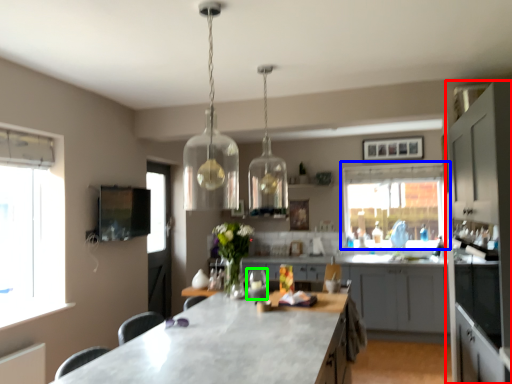
Question: Based on their relative distances, which object is farther from cabinetry (highlighted by a red box)? Choose from window (highlighted by a blue box) and wine glass (highlighted by a green box).

Choices:
 (A) window
 (B) wine glass

Answer: (A)